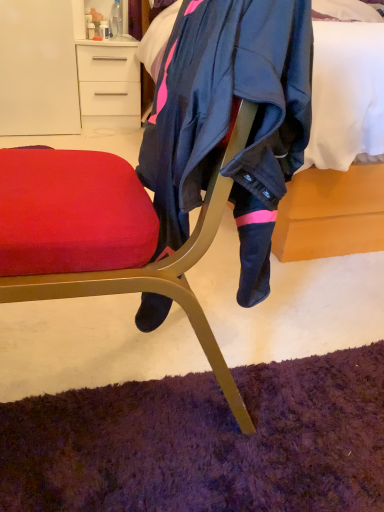
Question: Is soft white bed at upper center not within white glossy drawer at upper left?

Choices:
 (A) no
 (B) yes

Answer: (B)

Question: Is soft white bed at upper center in front of white glossy drawer at upper left?

Choices:
 (A) no
 (B) yes

Answer: (B)

Question: Can you confirm if soft white bed at upper center is wider than white glossy drawer at upper left?

Choices:
 (A) yes
 (B) no

Answer: (A)

Question: Is white glossy drawer at upper left completely or partially inside soft white bed at upper center?

Choices:
 (A) yes
 (B) no

Answer: (B)

Question: Considering the relative sizes of soft white bed at upper center and white glossy drawer at upper left in the image provided, is soft white bed at upper center bigger than white glossy drawer at upper left?

Choices:
 (A) no
 (B) yes

Answer: (B)

Question: Is soft white bed at upper center positioned with its back to white glossy drawer at upper left?

Choices:
 (A) yes
 (B) no

Answer: (B)

Question: Is white glossy drawer at upper left far away from soft white bed at upper center?

Choices:
 (A) yes
 (B) no

Answer: (A)

Question: Considering the relative sizes of white glossy drawer at upper left and soft white bed at upper center in the image provided, is white glossy drawer at upper left wider than soft white bed at upper center?

Choices:
 (A) yes
 (B) no

Answer: (B)

Question: Is white glossy drawer at upper left completely or partially outside of soft white bed at upper center?

Choices:
 (A) no
 (B) yes

Answer: (B)

Question: Can you confirm if white glossy drawer at upper left is smaller than soft white bed at upper center?

Choices:
 (A) yes
 (B) no

Answer: (A)

Question: Considering the relative sizes of white glossy drawer at upper left and soft white bed at upper center in the image provided, is white glossy drawer at upper left shorter than soft white bed at upper center?

Choices:
 (A) no
 (B) yes

Answer: (B)

Question: Is white glossy drawer at upper left positioned in front of soft white bed at upper center?

Choices:
 (A) yes
 (B) no

Answer: (B)

Question: From the image's perspective, is soft white bed at upper center located above or below white glossy drawer at upper left?

Choices:
 (A) below
 (B) above

Answer: (A)